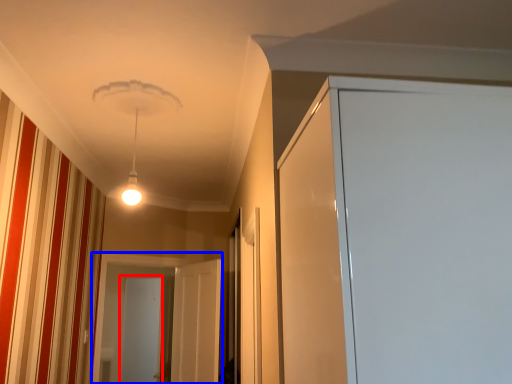
Question: Which point is further to the camera, screen door (highlighted by a red box) or screen door (highlighted by a blue box)?

Choices:
 (A) screen door
 (B) screen door

Answer: (A)